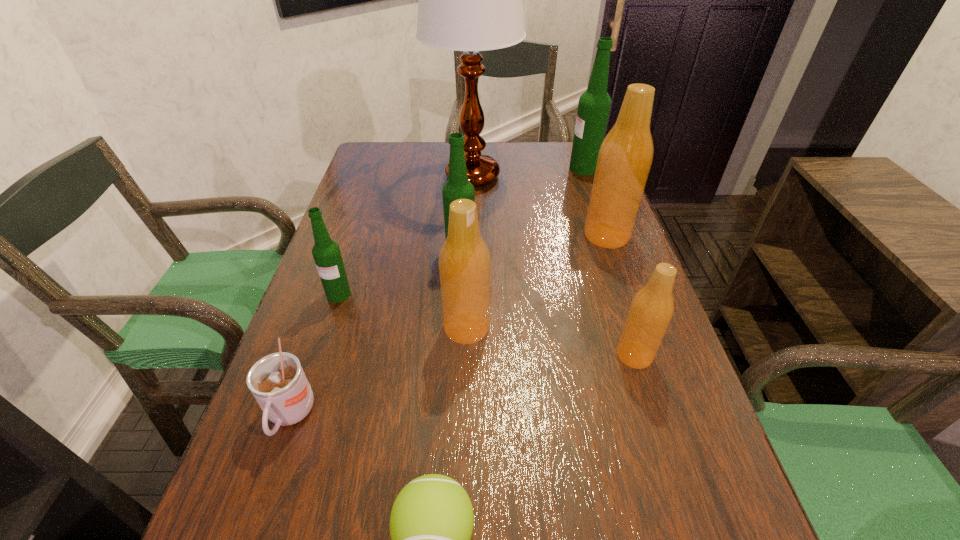
Identify the location of vacant space at the right edge. This screenshot has height=540, width=960. (569, 185).

In order to click on vacant space at the far left corner in this screenshot , I will do `click(372, 158)`.

The height and width of the screenshot is (540, 960). What are the coordinates of `free region at the far right corner of the desktop` in the screenshot? It's located at (574, 177).

Locate an element on the screen. vacant point located between the cup and the second smallest tan beer bottle is located at coordinates (378, 372).

Where is `vacant area between the second smallest tan beer bottle and the rightmost green beer bottle`? vacant area between the second smallest tan beer bottle and the rightmost green beer bottle is located at coordinates (525, 248).

At what (x,y) coordinates should I click in order to perform the action: click on empty location between the second green beer bottle from left to right and the smallest tan beer bottle. Please return your answer as a coordinate pair (x, y). Looking at the image, I should click on (547, 302).

I want to click on free space between the biggest tan beer bottle and the second green beer bottle from left to right, so click(534, 242).

At what (x,y) coordinates should I click in order to perform the action: click on vacant space in between the leftmost tan beer bottle and the biggest tan beer bottle. Please return your answer as a coordinate pair (x, y). This screenshot has height=540, width=960. Looking at the image, I should click on (537, 281).

The image size is (960, 540). Find the location of `object that is the closest to the white table lamp`. object that is the closest to the white table lamp is located at coordinates (594, 105).

At what (x,y) coordinates should I click in order to perform the action: click on object that is the sixth closest to the tallest object. Please return your answer as a coordinate pair (x, y). Image resolution: width=960 pixels, height=540 pixels. Looking at the image, I should click on (652, 307).